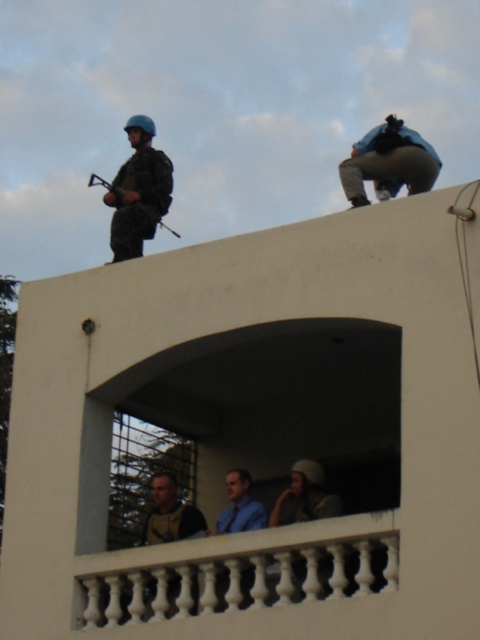
You are a security guard observing the roof from a surveillance camera. You notice the matte black helmet at upper left and the metallic gun at upper left. Which object is closer to the top edge of the roof?

The matte black helmet at upper left is taller than the metallic gun at upper left, so the matte black helmet at upper left is closer to the top edge of the roof.

You are a security guard monitoring the rooftop. You notice two objects on the monitor screen. The matte black helmet at upper left and the blue fabric camera at upper center. Which object is closer to the bottom edge of the screen?

The matte black helmet at upper left is closer to the bottom edge of the screen because it is positioned below the blue fabric camera at upper center.